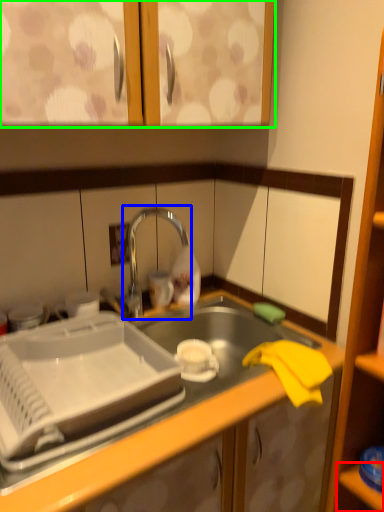
Question: Considering the real-world distances, which object is closest to shelf (highlighted by a red box)? tap (highlighted by a blue box) or cabinetry (highlighted by a green box).

Choices:
 (A) tap
 (B) cabinetry

Answer: (A)